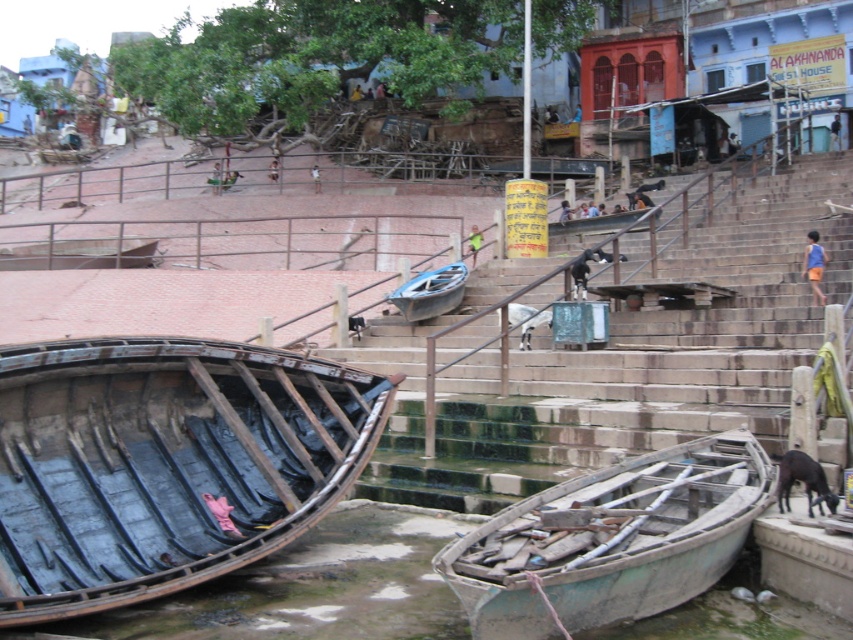
You are a tourist visiting the riverside and want to take a photo of the smooth stone stairs at center while avoiding the rusty wood boat at lower left. Which direction should you move to ensure the boat is out of the frame?

Move to the right side of the smooth stone stairs at center so that the rusty wood boat at lower left is no longer visible in the photo.

You are standing at the top of the stone steps on the riverbank. You want to reach the green weathered boat at lower right. Which direction should you walk to get there?

You should walk downward along the stone steps towards the water to reach the green weathered boat at lower right, as it is located at the lower part of the riverbank.